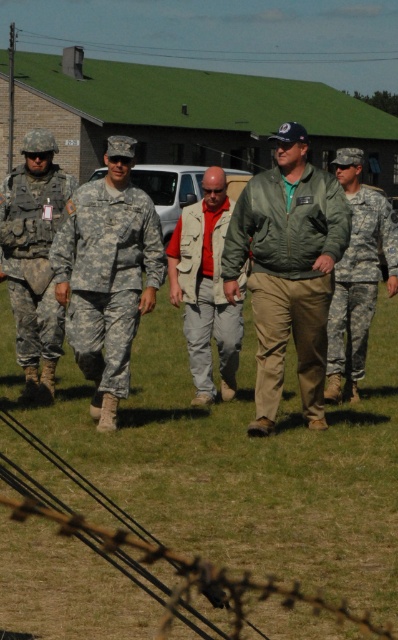
Who is lower down, camouflage uniform at center or camouflage fabric pants at right?

camouflage fabric pants at right

Can you confirm if camouflage uniform at center is thinner than camouflage fabric pants at right?

Yes, camouflage uniform at center is thinner than camouflage fabric pants at right.

Is point (152, 307) closer to camera compared to point (374, 232)?

Yes, it is.

The width and height of the screenshot is (398, 640). I want to click on camouflage uniform at center, so click(101, 275).

Is camouflage fabric uniform at center positioned before brushed metal wire at upper center?

Yes.

In the scene shown: Who is taller, camouflage fabric uniform at center or brushed metal wire at upper center?

→ brushed metal wire at upper center

Describe the element at coordinates (107, 276) in the screenshot. I see `camouflage fabric uniform at center` at that location.

The width and height of the screenshot is (398, 640). Identify the location of camouflage fabric uniform at center. (107, 276).

Describe the element at coordinates (33, 316) in the screenshot. I see `camouflage fabric uniform at left` at that location.

Consider the image. Does camouflage fabric uniform at left have a smaller size compared to brushed metal wire at upper center?

Yes.

Between point (1, 189) and point (325, 56), which one is positioned behind?

Point (325, 56)

Find the location of a particular element. The image size is (398, 640). camouflage fabric uniform at left is located at coordinates (33, 316).